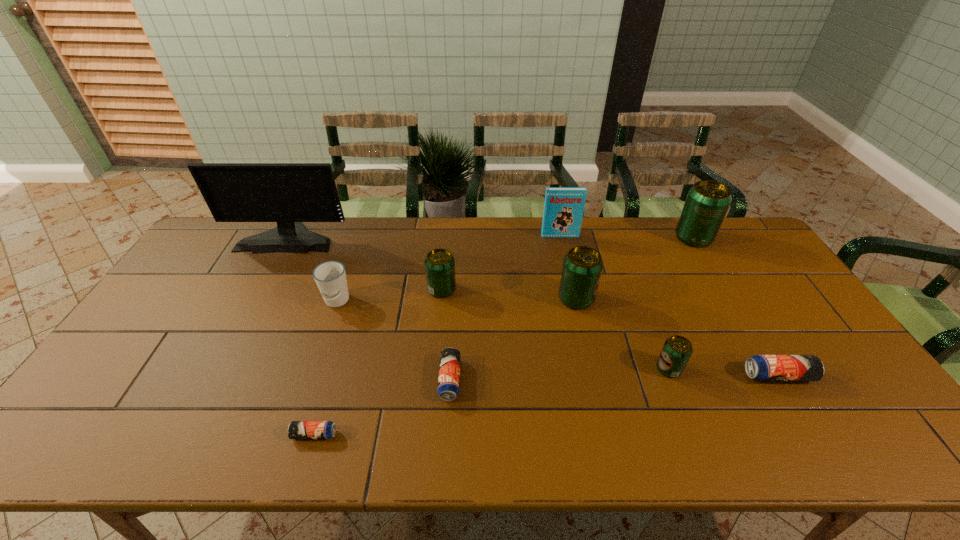
This screenshot has width=960, height=540. Identify the location of the third beer can from right to left. (677, 350).

Identify the location of the eighth tallest object. (759, 367).

Identify the location of the biggest blue beer can. The width and height of the screenshot is (960, 540). (759, 367).

Locate an element on the screen. Image resolution: width=960 pixels, height=540 pixels. the second biggest blue beer can is located at coordinates (449, 370).

You are a GUI agent. You are given a task and a screenshot of the screen. Output one action in this format:
    pyautogui.click(x=<x>, y=<y>)
    Task: Click on the second shortest beer can
    
    Given the screenshot: What is the action you would take?
    pyautogui.click(x=449, y=370)

This screenshot has height=540, width=960. In order to click on the nearest blue beer can in this screenshot , I will do click(296, 429).

Find the location of a particular element. the leftmost beer can is located at coordinates (296, 429).

The height and width of the screenshot is (540, 960). What are the coordinates of `vacant space located on the screen side of the monitor` in the screenshot? It's located at (231, 343).

Identify the location of vacant space situated on the front of the farthest beer can. (737, 311).

Locate an element on the screen. The width and height of the screenshot is (960, 540). free point located on the front cover of the book is located at coordinates (579, 319).